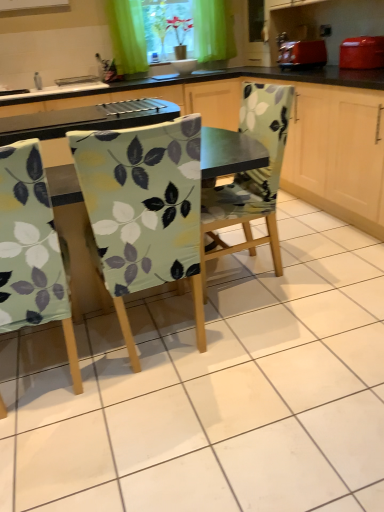
Question: From a real-world perspective, does matte red toaster at upper right sit lower than green fabric curtain at upper center?

Choices:
 (A) yes
 (B) no

Answer: (A)

Question: Could green fabric curtain at upper center be considered to be inside matte red toaster at upper right?

Choices:
 (A) no
 (B) yes

Answer: (A)

Question: From a real-world perspective, is matte red toaster at upper right on green fabric curtain at upper center?

Choices:
 (A) no
 (B) yes

Answer: (A)

Question: Is matte red toaster at upper right smaller than green fabric curtain at upper center?

Choices:
 (A) no
 (B) yes

Answer: (B)

Question: From the image's perspective, is matte red toaster at upper right on green fabric curtain at upper center?

Choices:
 (A) yes
 (B) no

Answer: (B)

Question: From the image's perspective, would you say matte red toaster at upper right is shown under green fabric curtain at upper center?

Choices:
 (A) yes
 (B) no

Answer: (A)

Question: Could floral fabric chair at center, acting as the third chair starting from the left, be considered to be inside light green fabric chair at left, placed as the 3th chair when sorted from right to left?

Choices:
 (A) no
 (B) yes

Answer: (A)

Question: Is light green fabric chair at left, placed as the 3th chair when sorted from right to left, wider than floral fabric chair at center, the first chair viewed from the right?

Choices:
 (A) no
 (B) yes

Answer: (A)

Question: Is light green fabric chair at left, placed as the 3th chair when sorted from right to left, shorter than floral fabric chair at center, the first chair viewed from the right?

Choices:
 (A) no
 (B) yes

Answer: (A)

Question: Does light green fabric chair at left, placed as the 3th chair when sorted from right to left, have a smaller size compared to floral fabric chair at center, the first chair viewed from the right?

Choices:
 (A) yes
 (B) no

Answer: (A)

Question: Is light green fabric chair at left, placed as the 3th chair when sorted from right to left, aimed at floral fabric chair at center, acting as the third chair starting from the left?

Choices:
 (A) no
 (B) yes

Answer: (A)

Question: Is light green fabric chair at left, placed as the 3th chair when sorted from right to left, placed right next to floral fabric chair at center, the first chair viewed from the right?

Choices:
 (A) no
 (B) yes

Answer: (A)

Question: Is floral fabric chair at center, acting as the third chair starting from the left, looking in the opposite direction of matte red toaster at upper right?

Choices:
 (A) yes
 (B) no

Answer: (B)